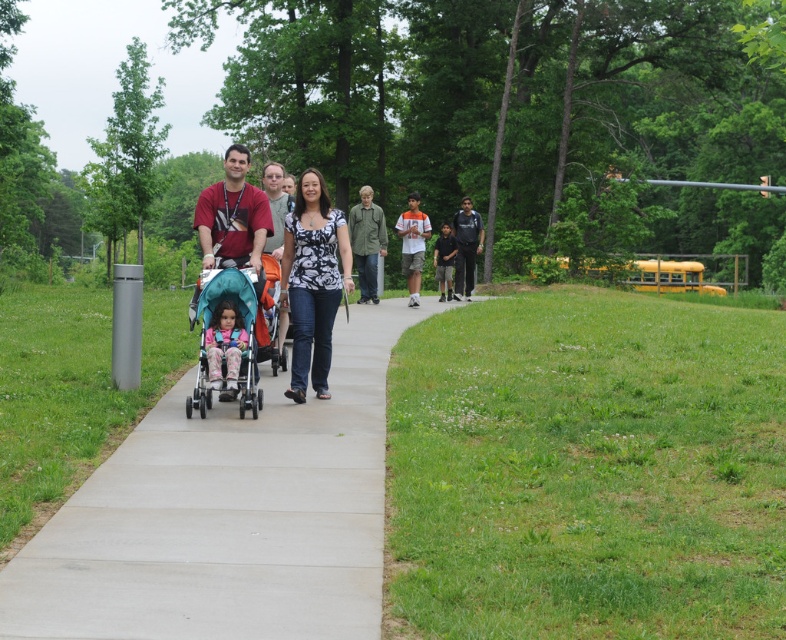
You are a drone operator trying to capture a photo of the stroller with the turquoise canopy and orange accents. The stroller is in the center of the image. To ensure the stroller is in focus, you need to adjust the camera to focus on the concrete at center located at point (228, 515). Is the stroller positioned at the same point as the concrete at center?

The concrete at center is located at point (228, 515), so yes, the stroller with the turquoise canopy and orange accents is positioned at the same point as the concrete at center.

You are standing at the position of point (320, 228) and want to walk to the position of point (318, 321). Which direction should you move to get closer to your destination?

You should move forward because point (318, 321) is further to the camera than point (320, 228), so moving forward along the path will bring you closer to your destination.